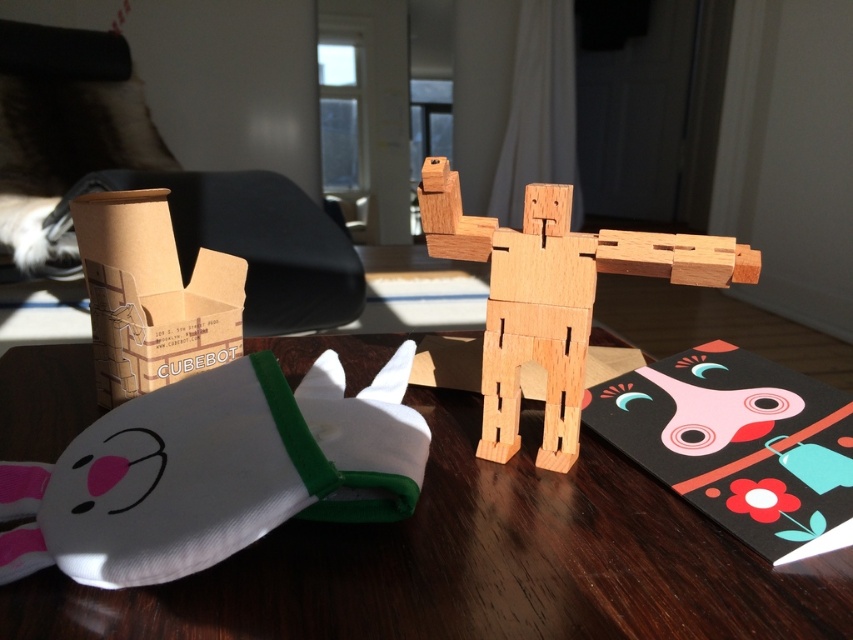
Question: Does white fabric plush at lower left appear on the left side of brown cardboard box at left?

Choices:
 (A) no
 (B) yes

Answer: (A)

Question: Considering the real-world distances, which object is farthest from the brown cardboard box at left?

Choices:
 (A) wooden table at center
 (B) white fabric plush at lower left

Answer: (A)

Question: Based on their relative distances, which object is nearer to the natural wood wooden figure at center?

Choices:
 (A) white fabric plush at lower left
 (B) brown cardboard box at left
 (C) black matte card at right

Answer: (C)

Question: Is white fabric plush at lower left further to the viewer compared to black matte card at right?

Choices:
 (A) yes
 (B) no

Answer: (B)

Question: Considering the relative positions of black matte card at right and natural wood wooden figure at center in the image provided, where is black matte card at right located with respect to natural wood wooden figure at center?

Choices:
 (A) right
 (B) left

Answer: (A)

Question: Which of the following is the closest to the observer?

Choices:
 (A) (582, 244)
 (B) (753, 422)

Answer: (A)